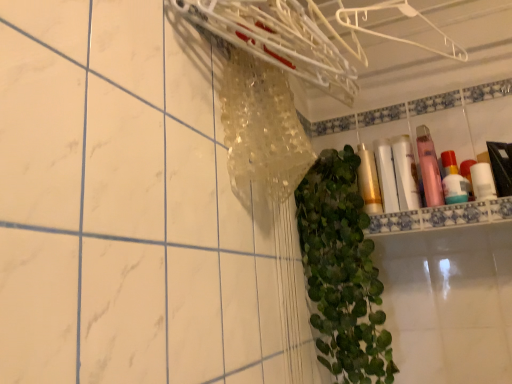
Question: Considering the relative sizes of pink matte bottle at upper right, the 5th toiletry viewed from the left, and white glossy tube at upper right, which is the third toiletry in left-to-right order, in the image provided, is pink matte bottle at upper right, the 5th toiletry viewed from the left, taller than white glossy tube at upper right, which is the third toiletry in left-to-right order,?

Choices:
 (A) yes
 (B) no

Answer: (B)

Question: Is pink matte bottle at upper right, the 5th toiletry viewed from the left, positioned beyond the bounds of white glossy tube at upper right, acting as the fourth toiletry starting from the right?

Choices:
 (A) yes
 (B) no

Answer: (A)

Question: Can you confirm if pink matte bottle at upper right, which appears as the second toiletry when viewed from the right, is shorter than white glossy tube at upper right, acting as the fourth toiletry starting from the right?

Choices:
 (A) yes
 (B) no

Answer: (A)

Question: Can you confirm if pink matte bottle at upper right, the 5th toiletry viewed from the left, is wider than white glossy tube at upper right, acting as the fourth toiletry starting from the right?

Choices:
 (A) yes
 (B) no

Answer: (B)

Question: Is the surface of pink matte bottle at upper right, which appears as the second toiletry when viewed from the right, in direct contact with white glossy tube at upper right, which is the third toiletry in left-to-right order?

Choices:
 (A) yes
 (B) no

Answer: (B)

Question: Can you confirm if pink matte bottle at upper right, which appears as the second toiletry when viewed from the right, is positioned to the right of white glossy tube at upper right, which is the third toiletry in left-to-right order?

Choices:
 (A) yes
 (B) no

Answer: (A)

Question: From a real-world perspective, is white glossy shelf at upper right over white plastic hanger at upper center, which is counted as the second hanger, starting from the left?

Choices:
 (A) no
 (B) yes

Answer: (A)

Question: Is white glossy shelf at upper right next to white plastic hanger at upper center, the first hanger positioned from the right, and touching it?

Choices:
 (A) no
 (B) yes

Answer: (A)

Question: From the image's perspective, is white glossy shelf at upper right located above white plastic hanger at upper center, which is counted as the second hanger, starting from the left?

Choices:
 (A) no
 (B) yes

Answer: (A)

Question: Is white glossy shelf at upper right smaller than white plastic hanger at upper center, the first hanger positioned from the right?

Choices:
 (A) yes
 (B) no

Answer: (B)

Question: Does white glossy shelf at upper right turn towards white plastic hanger at upper center, which is counted as the second hanger, starting from the left?

Choices:
 (A) yes
 (B) no

Answer: (B)

Question: Can you confirm if white glossy shelf at upper right is shorter than white plastic hanger at upper center, the first hanger positioned from the right?

Choices:
 (A) yes
 (B) no

Answer: (A)

Question: From the image's perspective, does green leafy plant at center appear lower than clear plastic hanger at upper center, which is the second hanger from right to left?

Choices:
 (A) yes
 (B) no

Answer: (A)